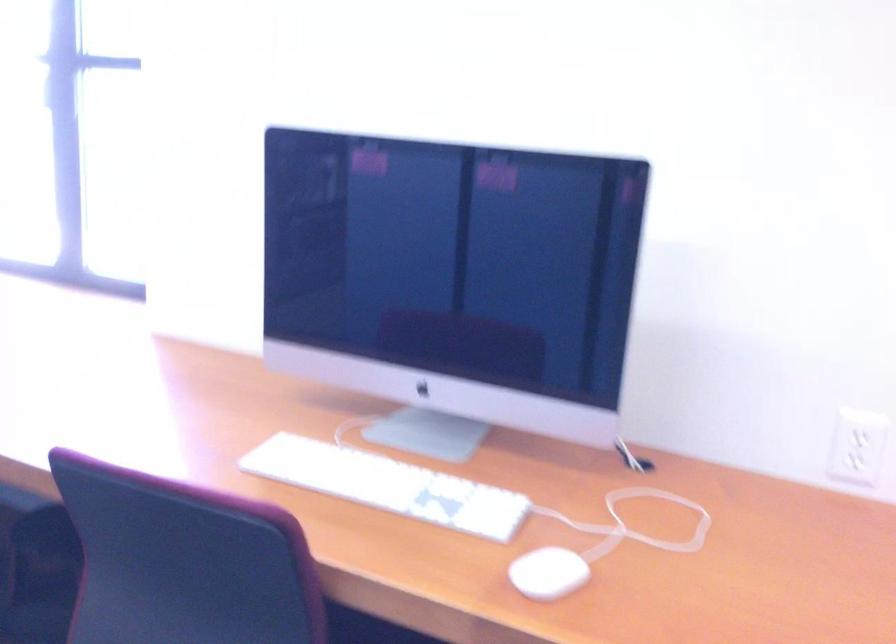
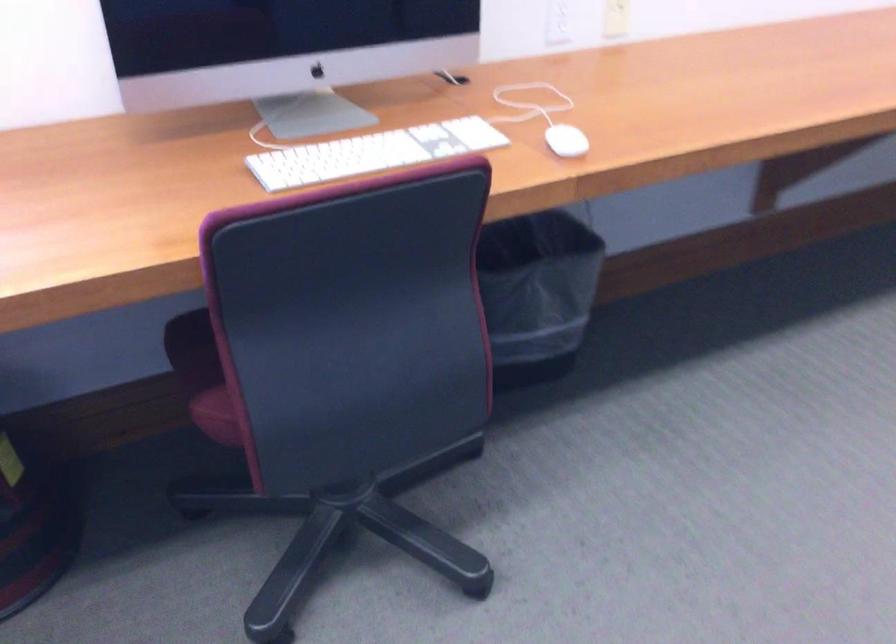
Locate, in the second image, the point that corresponds to pixel 369 482 in the first image.

(372, 153)